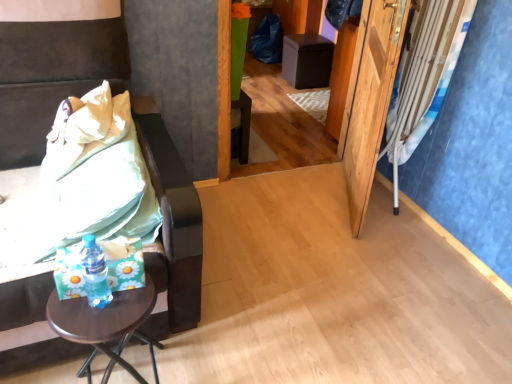
Where is `vacant region to the right of translucent plastic bottle at lower left`? The height and width of the screenshot is (384, 512). vacant region to the right of translucent plastic bottle at lower left is located at coordinates (132, 306).